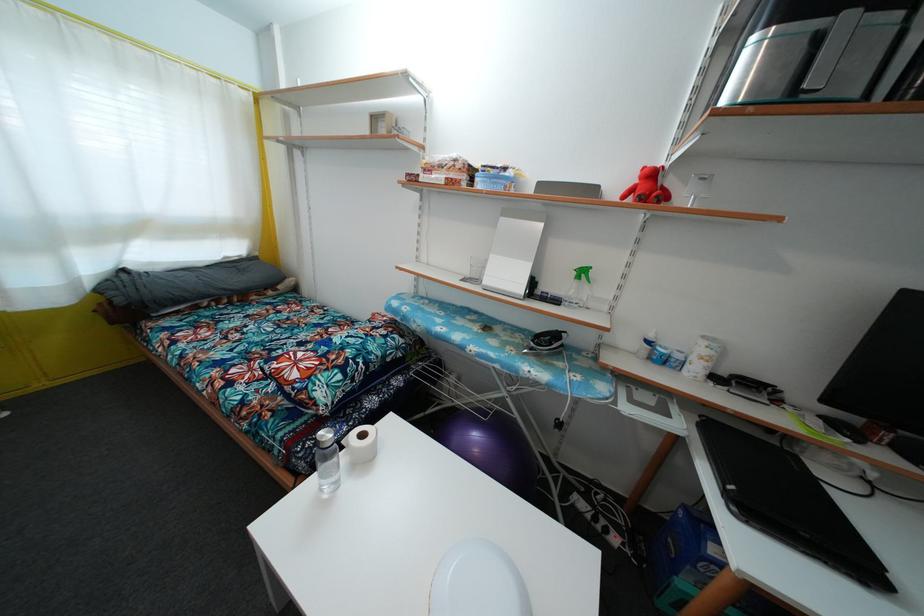
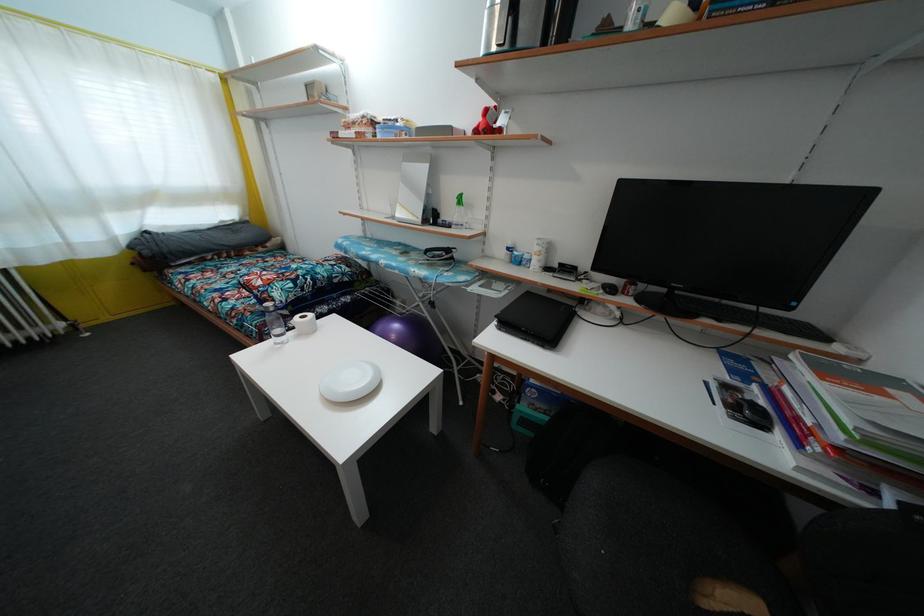
The point at (292,395) is marked in the first image. Where is the corresponding point in the second image?

(259, 299)